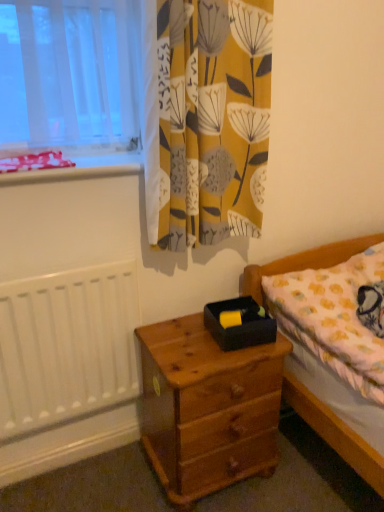
Question: Is yellow fabric curtain at upper center beside white painted radiator at left?

Choices:
 (A) yes
 (B) no

Answer: (B)

Question: Would you say yellow fabric curtain at upper center contains white painted radiator at left?

Choices:
 (A) no
 (B) yes

Answer: (A)

Question: Can you confirm if yellow fabric curtain at upper center is positioned to the right of white painted radiator at left?

Choices:
 (A) no
 (B) yes

Answer: (B)

Question: Is yellow fabric curtain at upper center at the left side of white painted radiator at left?

Choices:
 (A) no
 (B) yes

Answer: (A)

Question: Can you confirm if yellow fabric curtain at upper center is thinner than white painted radiator at left?

Choices:
 (A) yes
 (B) no

Answer: (B)

Question: Does yellow fabric curtain at upper center have a lesser height compared to white painted radiator at left?

Choices:
 (A) no
 (B) yes

Answer: (A)

Question: From the image's perspective, is black matte box at center below wooden nightstand at lower center?

Choices:
 (A) no
 (B) yes

Answer: (A)

Question: Would you say black matte box at center is outside wooden nightstand at lower center?

Choices:
 (A) no
 (B) yes

Answer: (B)

Question: Is black matte box at center further to the viewer compared to wooden nightstand at lower center?

Choices:
 (A) no
 (B) yes

Answer: (B)

Question: Can you confirm if black matte box at center is positioned to the right of wooden nightstand at lower center?

Choices:
 (A) yes
 (B) no

Answer: (A)

Question: Is black matte box at center shorter than wooden nightstand at lower center?

Choices:
 (A) yes
 (B) no

Answer: (A)

Question: Is wooden nightstand at lower center completely or partially inside black matte box at center?

Choices:
 (A) yes
 (B) no

Answer: (B)

Question: From the image's perspective, is wooden nightstand at lower center over red plastic tray at upper left?

Choices:
 (A) no
 (B) yes

Answer: (A)